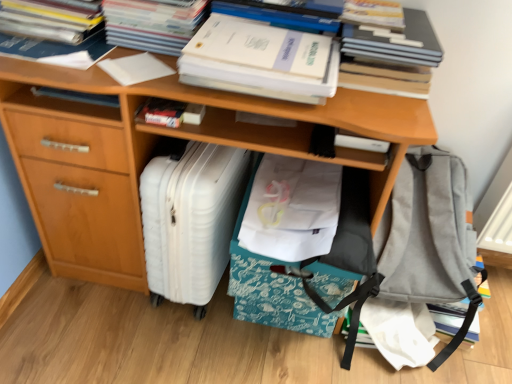
Question: Considering the positions of hardcover book at upper right, which is the sixth book in left-to-right order, and white matte paper at upper center, the 3th paperback book viewed from the left, in the image, is hardcover book at upper right, which is the sixth book in left-to-right order, bigger or smaller than white matte paper at upper center, the 3th paperback book viewed from the left,?

Choices:
 (A) small
 (B) big

Answer: (A)

Question: From a real-world perspective, is hardcover book at upper right, the 1th book when ordered from right to left, above or below white matte paper at upper center, the 3th paperback book viewed from the left?

Choices:
 (A) above
 (B) below

Answer: (B)

Question: Estimate the real-world distances between objects in this image. Which object is farther from the white paper at upper left, which appears as the sixth book when viewed from the right?

Choices:
 (A) white paper at upper left, which is counted as the second book, starting from the left
 (B) white paper at upper left, which appears as the 4th book when viewed from the right
 (C) white matte book at center, positioned as the 4th book in left-to-right order
 (D) wooden desk at center
 (E) hardcover book at center, the first paperback book viewed from the left

Answer: (D)

Question: Which of these objects is positioned closest to the white matte paper at upper center, which appears as the first paperback book when viewed from the right?

Choices:
 (A) white paper at upper left, which appears as the sixth book when viewed from the right
 (B) white paper at upper center, positioned as the 2th paperback book in right-to-left order
 (C) white plastic suitcase at lower left
 (D) gray fabric backpack at lower right
 (E) hardcover book at center, the first paperback book viewed from the left

Answer: (B)